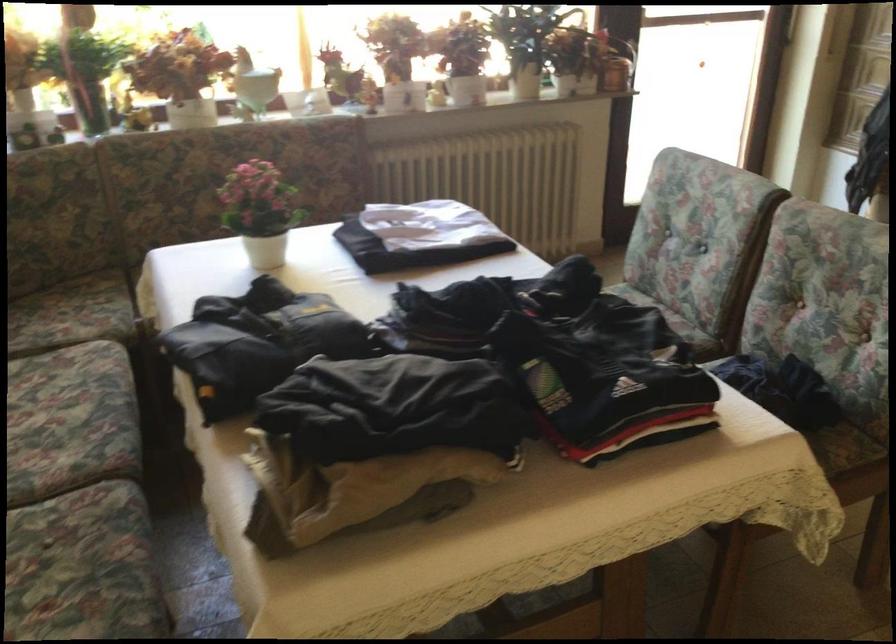
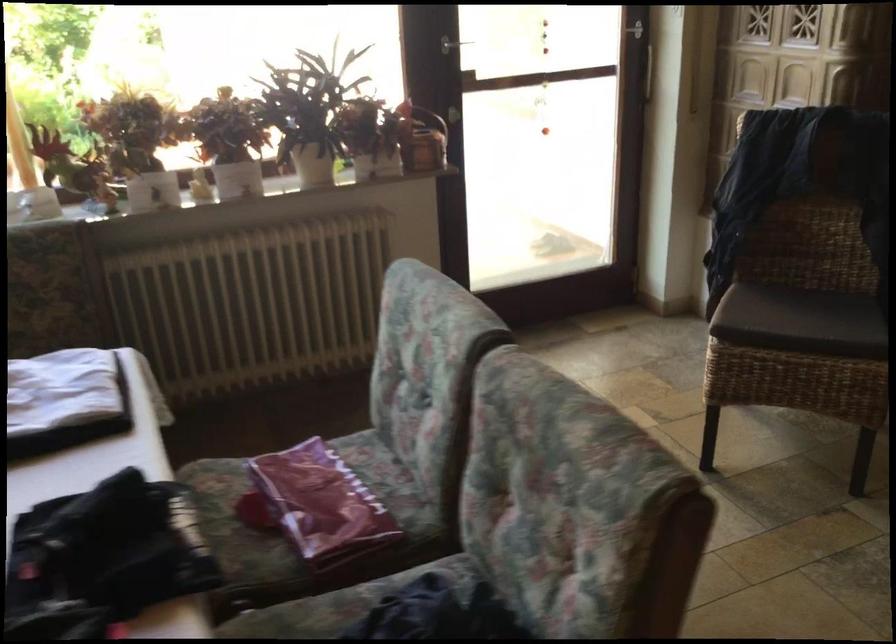
Question: The first image is from the beginning of the video and the second image is from the end. How did the camera likely rotate when shooting the video?

Choices:
 (A) Left
 (B) Right
 (C) Up
 (D) Down

Answer: (C)